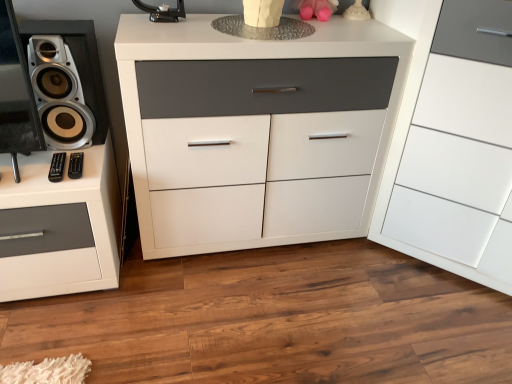
Question: Can you confirm if pink rubber toy at upper center is bigger than white glossy drawer at center, the first chest of drawers when ordered from right to left?

Choices:
 (A) yes
 (B) no

Answer: (B)

Question: Is pink rubber toy at upper center smaller than white glossy drawer at center, the first chest of drawers when ordered from right to left?

Choices:
 (A) yes
 (B) no

Answer: (A)

Question: From a real-world perspective, is pink rubber toy at upper center on top of white glossy drawer at center, which appears as the 2th chest of drawers when viewed from the left?

Choices:
 (A) no
 (B) yes

Answer: (B)

Question: Can you confirm if pink rubber toy at upper center is taller than white glossy drawer at center, which appears as the 2th chest of drawers when viewed from the left?

Choices:
 (A) no
 (B) yes

Answer: (A)

Question: Is the depth of pink rubber toy at upper center less than that of white glossy drawer at center, the first chest of drawers when ordered from right to left?

Choices:
 (A) yes
 (B) no

Answer: (B)

Question: From the image's perspective, is white glossy speaker at left positioned above or below black plastic remote at lower left?

Choices:
 (A) below
 (B) above

Answer: (B)

Question: Is white glossy speaker at left wider or thinner than black plastic remote at lower left?

Choices:
 (A) thin
 (B) wide

Answer: (B)

Question: From a real-world perspective, is white glossy speaker at left positioned above or below black plastic remote at lower left?

Choices:
 (A) above
 (B) below

Answer: (A)

Question: Is white glossy speaker at left situated inside black plastic remote at lower left or outside?

Choices:
 (A) outside
 (B) inside

Answer: (A)

Question: From the image's perspective, relative to pink rubber toy at upper center, is white glossy speaker at left above or below?

Choices:
 (A) below
 (B) above

Answer: (A)

Question: From a real-world perspective, relative to pink rubber toy at upper center, is white glossy speaker at left vertically above or below?

Choices:
 (A) below
 (B) above

Answer: (A)

Question: Is white glossy speaker at left bigger or smaller than pink rubber toy at upper center?

Choices:
 (A) big
 (B) small

Answer: (A)

Question: Considering the positions of white glossy speaker at left and pink rubber toy at upper center in the image, is white glossy speaker at left taller or shorter than pink rubber toy at upper center?

Choices:
 (A) tall
 (B) short

Answer: (A)

Question: In terms of width, does black plastic remote at lower left look wider or thinner when compared to pink rubber toy at upper center?

Choices:
 (A) thin
 (B) wide

Answer: (B)

Question: From the image's perspective, is black plastic remote at lower left positioned above or below pink rubber toy at upper center?

Choices:
 (A) below
 (B) above

Answer: (A)